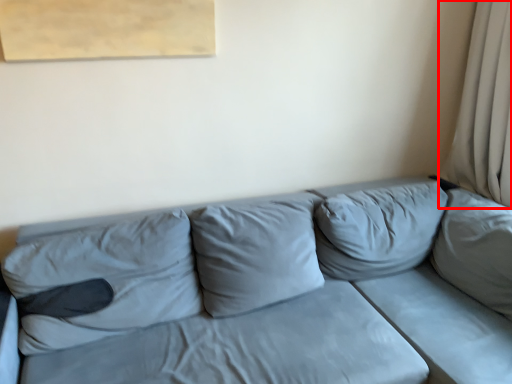
Question: From the image, what is the correct spatial relationship of curtain (annotated by the red box) in relation to studio couch?

Choices:
 (A) left
 (B) right

Answer: (B)